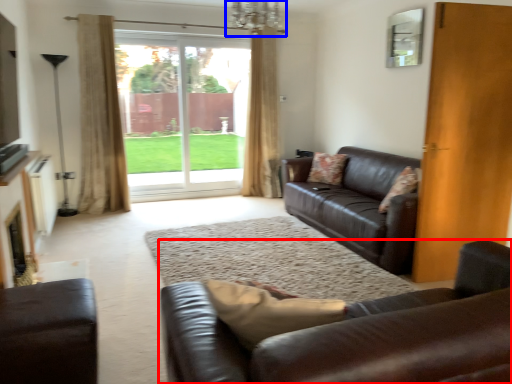
Question: Which point is closer to the camera, studio couch (highlighted by a red box) or chandelier (highlighted by a blue box)?

Choices:
 (A) studio couch
 (B) chandelier

Answer: (A)